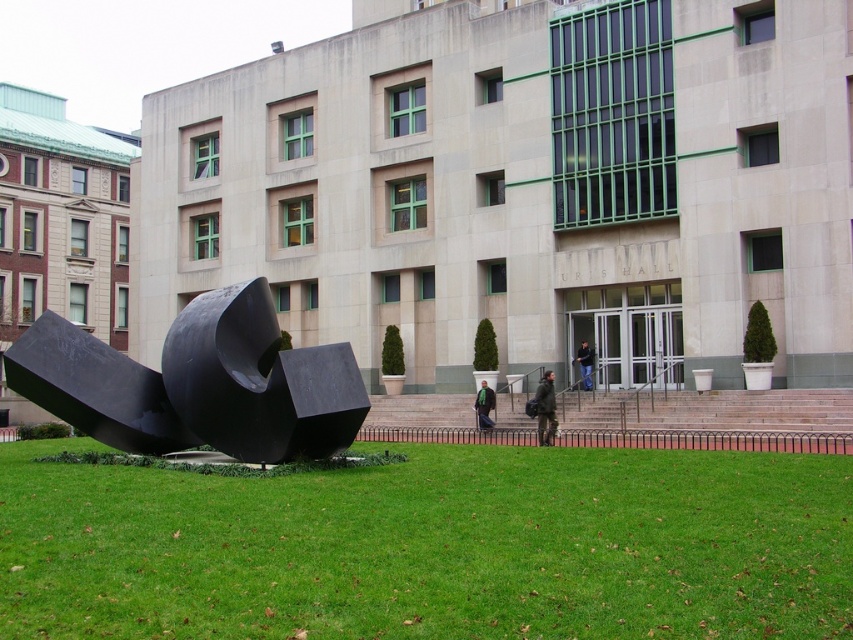
Who is lower down, black polished sculpture at lower left or dark green jacket at entrance?

Positioned lower is dark green jacket at entrance.

Can you confirm if black polished sculpture at lower left is bigger than dark green jacket at entrance?

Yes.

Locate an element on the screen. This screenshot has width=853, height=640. black polished sculpture at lower left is located at coordinates (198, 384).

Does dark green jacket at center appear on the left side of dark green jacket at entrance?

Indeed, dark green jacket at center is positioned on the left side of dark green jacket at entrance.

Who is higher up, dark green jacket at center or dark green jacket at entrance?

dark green jacket at entrance

Image resolution: width=853 pixels, height=640 pixels. What do you see at coordinates (544, 408) in the screenshot?
I see `dark green jacket at center` at bounding box center [544, 408].

Find the location of `dark green jacket at center`. dark green jacket at center is located at coordinates (544, 408).

Is point (236, 362) farther from camera compared to point (547, 420)?

No, (236, 362) is closer to viewer.

Does black polished sculpture at lower left appear over dark green jacket at center?

Indeed, black polished sculpture at lower left is positioned over dark green jacket at center.

Does point (309, 356) come behind point (544, 385)?

That is False.

Locate an element on the screen. The height and width of the screenshot is (640, 853). black polished sculpture at lower left is located at coordinates (198, 384).